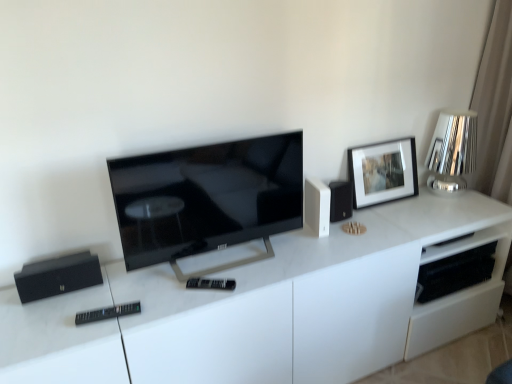
This screenshot has height=384, width=512. I want to click on free point to the left of black plastic remote at center, the 1th remote when ordered from right to left, so click(x=164, y=296).